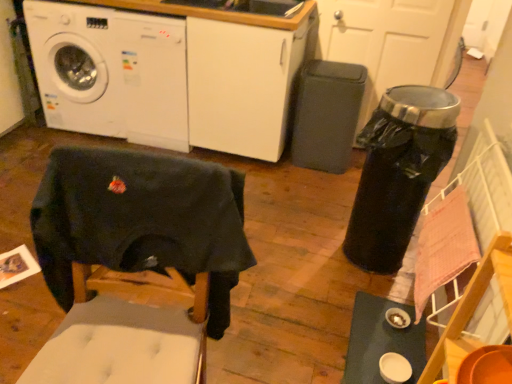
Question: From the image's perspective, is white glossy table at lower right beneath white glossy washing machine at upper left, which is the 2th washing machine in right-to-left order?

Choices:
 (A) yes
 (B) no

Answer: (A)

Question: Is white glossy table at lower right placed right next to white glossy washing machine at upper left, which is the 2th washing machine in right-to-left order?

Choices:
 (A) no
 (B) yes

Answer: (A)

Question: Is white glossy table at lower right smaller than white glossy washing machine at upper left, the 1th washing machine when ordered from left to right?

Choices:
 (A) no
 (B) yes

Answer: (B)

Question: Is white glossy table at lower right bigger than white glossy washing machine at upper left, the 1th washing machine when ordered from left to right?

Choices:
 (A) yes
 (B) no

Answer: (B)

Question: From a real-world perspective, is white glossy table at lower right over white glossy washing machine at upper left, the 1th washing machine when ordered from left to right?

Choices:
 (A) no
 (B) yes

Answer: (A)

Question: Does white glossy table at lower right have a lesser height compared to white glossy washing machine at upper left, which is the 2th washing machine in right-to-left order?

Choices:
 (A) no
 (B) yes

Answer: (B)

Question: Is dark fabric swivel chair at lower left positioned in front of white glossy washing machine at upper left, the second washing machine in the left-to-right sequence?

Choices:
 (A) yes
 (B) no

Answer: (A)

Question: Can you confirm if dark fabric swivel chair at lower left is positioned to the right of white glossy washing machine at upper left, the second washing machine in the left-to-right sequence?

Choices:
 (A) yes
 (B) no

Answer: (A)

Question: Is white glossy washing machine at upper left, marked as the first washing machine in a right-to-left arrangement, at the back of dark fabric swivel chair at lower left?

Choices:
 (A) no
 (B) yes

Answer: (B)

Question: Is dark fabric swivel chair at lower left located outside white glossy washing machine at upper left, marked as the first washing machine in a right-to-left arrangement?

Choices:
 (A) no
 (B) yes

Answer: (B)

Question: Is the surface of dark fabric swivel chair at lower left in direct contact with white glossy washing machine at upper left, marked as the first washing machine in a right-to-left arrangement?

Choices:
 (A) yes
 (B) no

Answer: (B)

Question: Is dark fabric swivel chair at lower left bigger than white glossy washing machine at upper left, marked as the first washing machine in a right-to-left arrangement?

Choices:
 (A) no
 (B) yes

Answer: (A)

Question: Is dark fabric swivel chair at lower left far away from white glossy table at lower right?

Choices:
 (A) yes
 (B) no

Answer: (B)